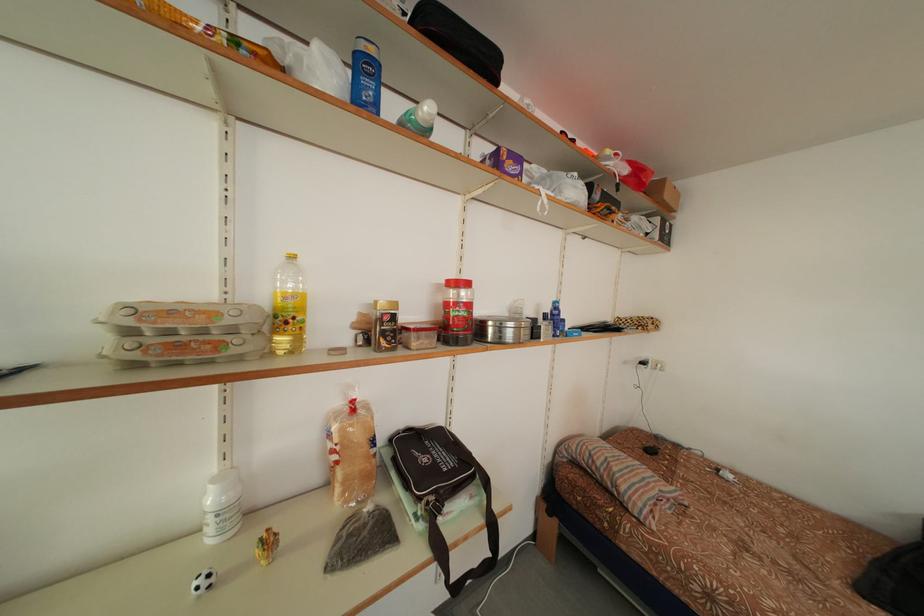
Where would you lift the blue plastic bottle? Please return your answer as a coordinate pair (x, y).

(555, 318)